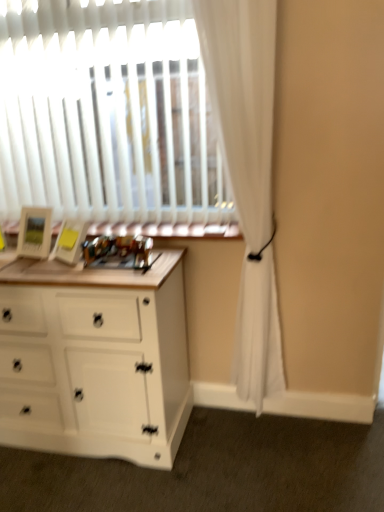
What are the coordinates of `vacant area on top of wooden frame at center (from a real-world perspective)` in the screenshot? It's located at (152, 221).